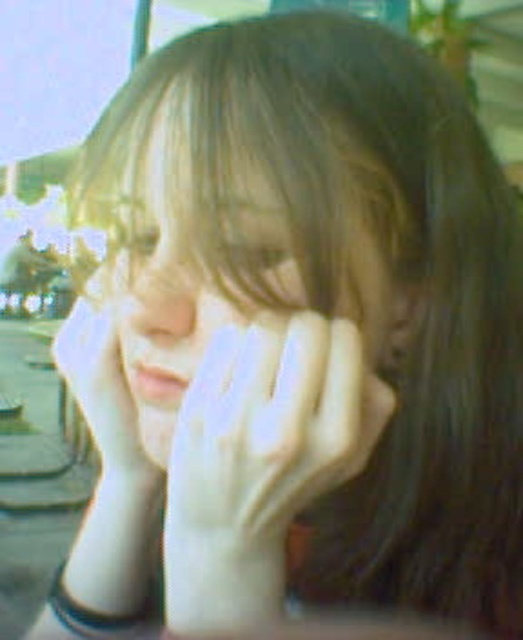
Question: Which is farther from the smooth skin face at center?

Choices:
 (A) smooth skin nose at center
 (B) white matte glove at center

Answer: (B)

Question: Among these objects, which one is farthest from the camera?

Choices:
 (A) white matte glove at center
 (B) smooth skin nose at center
 (C) smooth skin face at center

Answer: (B)

Question: From the image, what is the correct spatial relationship of smooth skin face at center in relation to smooth skin nose at center?

Choices:
 (A) below
 (B) above

Answer: (B)

Question: Where is smooth skin face at center located in relation to smooth skin nose at center in the image?

Choices:
 (A) left
 (B) right

Answer: (B)

Question: Is smooth skin face at center smaller than smooth skin nose at center?

Choices:
 (A) yes
 (B) no

Answer: (B)

Question: Which is farther from the white matte glove at center?

Choices:
 (A) smooth skin face at center
 (B) smooth skin nose at center

Answer: (B)